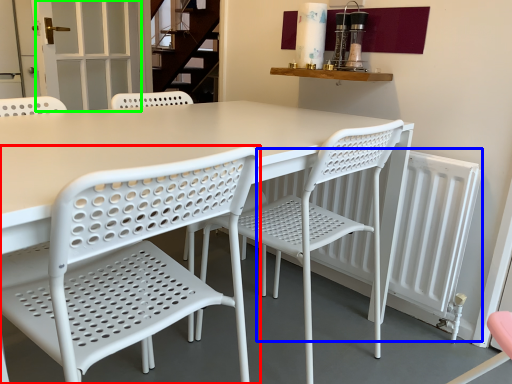
Question: Considering the real-world distances, which object is closest to chair (highlighted by a red box)? radiator (highlighted by a blue box) or screen door (highlighted by a green box).

Choices:
 (A) radiator
 (B) screen door

Answer: (A)